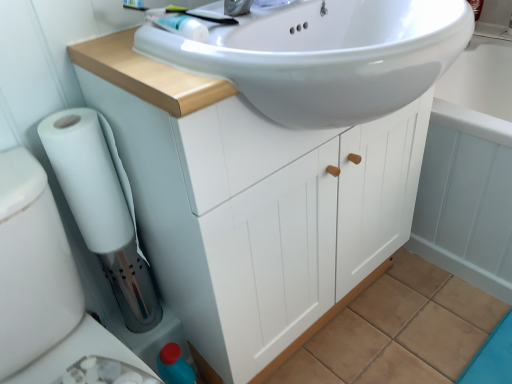
Find the location of a particular element. The image size is (512, 384). white matte cabinet at center is located at coordinates (250, 202).

The image size is (512, 384). What do you see at coordinates (326, 56) in the screenshot?
I see `white glossy sink at upper center` at bounding box center [326, 56].

Measure the distance between point [3,363] and camera.

The depth of point [3,363] is 29.17 inches.

Describe the element at coordinates (41, 283) in the screenshot. The height and width of the screenshot is (384, 512). I see `white plastic bidet at lower left, acting as the 1th bidet starting from the bottom` at that location.

This screenshot has height=384, width=512. What do you see at coordinates (77, 353) in the screenshot?
I see `blue plastic bidet at lower left, which appears as the 2th bidet when ordered from the bottom` at bounding box center [77, 353].

Locate an element on the screen. The image size is (512, 384). white matte cabinet at center is located at coordinates (250, 202).

Which object is wider, blue plastic bidet at lower left, positioned as the first bidet in top-to-bottom order, or white glossy sink at upper center?

With larger width is white glossy sink at upper center.

Visually, is blue plastic bidet at lower left, positioned as the first bidet in top-to-bottom order, positioned to the left or to the right of white glossy sink at upper center?

From the image, it's evident that blue plastic bidet at lower left, positioned as the first bidet in top-to-bottom order, is to the left of white glossy sink at upper center.

Is the surface of blue plastic bidet at lower left, positioned as the first bidet in top-to-bottom order, in direct contact with white glossy sink at upper center?

No, blue plastic bidet at lower left, positioned as the first bidet in top-to-bottom order, is not with white glossy sink at upper center.

Based on the photo, is blue plastic bidet at lower left, which appears as the 2th bidet when ordered from the bottom, turned away from white glossy sink at upper center?

No, blue plastic bidet at lower left, which appears as the 2th bidet when ordered from the bottom,'s orientation is not away from white glossy sink at upper center.

From the image's perspective, would you say white glossy sink at upper center is positioned over blue plastic bidet at lower left, positioned as the first bidet in top-to-bottom order?

Yes, from the image's perspective, white glossy sink at upper center is over blue plastic bidet at lower left, positioned as the first bidet in top-to-bottom order.

Which is in front, point (416, 96) or point (82, 322)?

The point (416, 96) is closer to the camera.

Between white glossy sink at upper center and blue plastic bidet at lower left, which appears as the 2th bidet when ordered from the bottom, which one appears on the left side from the viewer's perspective?

From the viewer's perspective, blue plastic bidet at lower left, which appears as the 2th bidet when ordered from the bottom, appears more on the left side.

Considering the sizes of objects white matte cabinet at center and white plastic bidet at lower left, acting as the 1th bidet starting from the bottom, in the image provided, who is thinner, white matte cabinet at center or white plastic bidet at lower left, acting as the 1th bidet starting from the bottom,?

white matte cabinet at center.

From the image's perspective, between white matte cabinet at center and white plastic bidet at lower left, acting as the 1th bidet starting from the bottom, which one is located above?

white matte cabinet at center is shown above in the image.

Is point (204, 334) closer to camera compared to point (100, 338)?

No, (204, 334) is further to viewer.

Relative to white plastic bidet at lower left, which is counted as the 2th bidet, starting from the top, is white matte cabinet at center in front or behind?

white matte cabinet at center is positioned farther from the viewer than white plastic bidet at lower left, which is counted as the 2th bidet, starting from the top.

In the image, is white matte cabinet at center positioned in front of or behind blue plastic bidet at lower left, which appears as the 2th bidet when ordered from the bottom?

white matte cabinet at center is positioned closer to the viewer than blue plastic bidet at lower left, which appears as the 2th bidet when ordered from the bottom.

Which of these two, white matte cabinet at center or blue plastic bidet at lower left, positioned as the first bidet in top-to-bottom order, stands taller?

white matte cabinet at center is taller.

In the scene shown: Can you confirm if white matte cabinet at center is wider than blue plastic bidet at lower left, positioned as the first bidet in top-to-bottom order?

Indeed, white matte cabinet at center has a greater width compared to blue plastic bidet at lower left, positioned as the first bidet in top-to-bottom order.

Locate an element on the screen. The height and width of the screenshot is (384, 512). bathroom cabinet above the blue plastic bidet at lower left, which appears as the 2th bidet when ordered from the bottom (from a real-world perspective) is located at coordinates (250, 202).

From a real-world perspective, between white plastic bidet at lower left, which is counted as the 2th bidet, starting from the top, and white glossy sink at upper center, who is vertically higher?

white glossy sink at upper center, from a real-world perspective.

In the scene shown: Is white plastic bidet at lower left, acting as the 1th bidet starting from the bottom, with white glossy sink at upper center?

No, white plastic bidet at lower left, acting as the 1th bidet starting from the bottom, is not touching white glossy sink at upper center.

Considering the positions of objects white plastic bidet at lower left, which is counted as the 2th bidet, starting from the top, and white glossy sink at upper center in the image provided, who is more to the left, white plastic bidet at lower left, which is counted as the 2th bidet, starting from the top, or white glossy sink at upper center?

white plastic bidet at lower left, which is counted as the 2th bidet, starting from the top, is more to the left.

Is white matte toilet paper at lower left to the left of white glossy bath at center from the viewer's perspective?

Indeed, white matte toilet paper at lower left is positioned on the left side of white glossy bath at center.

Is point (92, 230) less distant than point (499, 124)?

Yes, point (92, 230) is closer to viewer.

Is white glossy bath at center surrounded by white matte toilet paper at lower left?

No, white glossy bath at center is located outside of white matte toilet paper at lower left.

Is white matte toilet paper at lower left far away from white glossy bath at center?

white matte toilet paper at lower left is actually quite close to white glossy bath at center.

Between white glossy sink at upper center and white matte toilet paper at lower left, which one has larger width?

white glossy sink at upper center is wider.

Is white glossy sink at upper center far away from white matte toilet paper at lower left?

They are positioned close to each other.

Locate an element on the screen. The image size is (512, 384). toilet paper on the left side of white glossy sink at upper center is located at coordinates (89, 177).

Can you confirm if white glossy sink at upper center is positioned to the right of white matte toilet paper at lower left?

Indeed, white glossy sink at upper center is positioned on the right side of white matte toilet paper at lower left.

Identify the location of bidet behind the white glossy sink at upper center. The height and width of the screenshot is (384, 512). (77, 353).

Where is `sink that is above the blue plastic bidet at lower left, which appears as the 2th bidet when ordered from the bottom (from the image's perspective)`? sink that is above the blue plastic bidet at lower left, which appears as the 2th bidet when ordered from the bottom (from the image's perspective) is located at coordinates (326, 56).

When comparing their distances from white matte cabinet at center, does white glossy bath at center or white plastic bidet at lower left, which is counted as the 2th bidet, starting from the top, seem closer?

white plastic bidet at lower left, which is counted as the 2th bidet, starting from the top, is positioned closer to the anchor white matte cabinet at center.

Looking at the image, which one is located closer to white matte cabinet at center, white matte toilet paper at lower left or white glossy sink at upper center?

white glossy sink at upper center is closer to white matte cabinet at center.

Based on their spatial positions, is blue plastic bidet at lower left, which appears as the 2th bidet when ordered from the bottom, or white matte cabinet at center closer to white matte toilet paper at lower left?

blue plastic bidet at lower left, which appears as the 2th bidet when ordered from the bottom, is positioned closer to the anchor white matte toilet paper at lower left.

When comparing their distances from white matte cabinet at center, does blue plastic bidet at lower left, which appears as the 2th bidet when ordered from the bottom, or white glossy sink at upper center seem further?

Based on the image, blue plastic bidet at lower left, which appears as the 2th bidet when ordered from the bottom, appears to be further to white matte cabinet at center.

Estimate the real-world distances between objects in this image. Which object is further from white plastic bidet at lower left, which is counted as the 2th bidet, starting from the top, white glossy sink at upper center or blue plastic bidet at lower left, positioned as the first bidet in top-to-bottom order?

white glossy sink at upper center is positioned further to the anchor white plastic bidet at lower left, which is counted as the 2th bidet, starting from the top.

Considering their positions, is white glossy sink at upper center positioned closer to blue plastic bidet at lower left, positioned as the first bidet in top-to-bottom order, than white matte toilet paper at lower left?

white matte toilet paper at lower left is closer to blue plastic bidet at lower left, positioned as the first bidet in top-to-bottom order.

Considering their positions, is white matte cabinet at center positioned closer to white glossy bath at center than blue plastic bidet at lower left, positioned as the first bidet in top-to-bottom order?

The object closer to white glossy bath at center is white matte cabinet at center.

Looking at the image, which one is located closer to white plastic bidet at lower left, acting as the 1th bidet starting from the bottom, white glossy bath at center or blue plastic bidet at lower left, which appears as the 2th bidet when ordered from the bottom?

Among the two, blue plastic bidet at lower left, which appears as the 2th bidet when ordered from the bottom, is located nearer to white plastic bidet at lower left, acting as the 1th bidet starting from the bottom.

Where is `toilet paper between blue plastic bidet at lower left, which appears as the 2th bidet when ordered from the bottom, and white matte cabinet at center from left to right`? The image size is (512, 384). toilet paper between blue plastic bidet at lower left, which appears as the 2th bidet when ordered from the bottom, and white matte cabinet at center from left to right is located at coordinates (89, 177).

Image resolution: width=512 pixels, height=384 pixels. I want to click on toilet paper between white glossy sink at upper center and white plastic bidet at lower left, acting as the 1th bidet starting from the bottom, from top to bottom, so click(x=89, y=177).

Where is `bathroom cabinet between blue plastic bidet at lower left, which appears as the 2th bidet when ordered from the bottom, and white glossy bath at center, in the horizontal direction`? The width and height of the screenshot is (512, 384). bathroom cabinet between blue plastic bidet at lower left, which appears as the 2th bidet when ordered from the bottom, and white glossy bath at center, in the horizontal direction is located at coordinates (250, 202).

Image resolution: width=512 pixels, height=384 pixels. I want to click on toilet paper between white glossy sink at upper center and blue plastic bidet at lower left, which appears as the 2th bidet when ordered from the bottom, from top to bottom, so click(x=89, y=177).